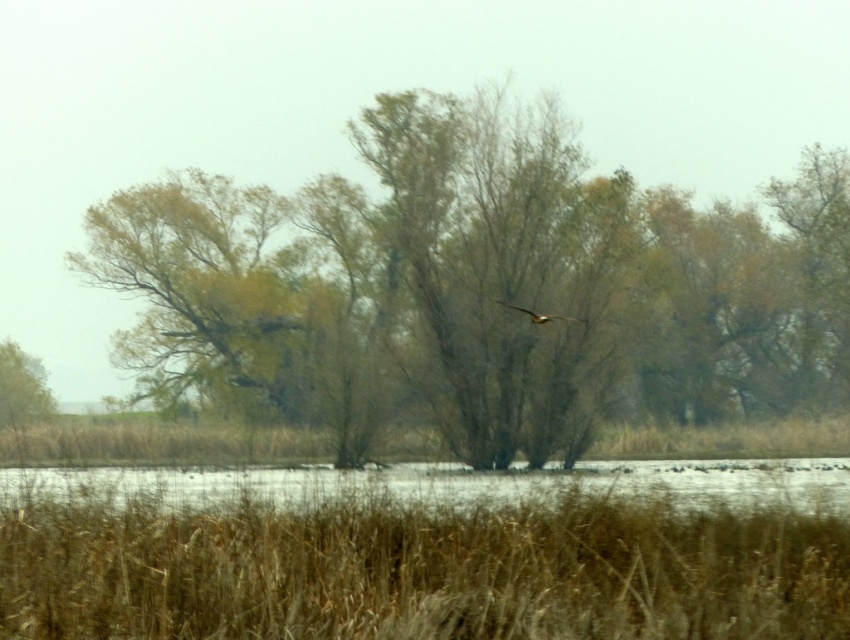
You are a birdwatcher observing the scene. You see the brown leafy tree at left and the brown feathered bird at center. Which object is taller?

The brown leafy tree at left is much taller than the brown feathered bird at center.

What object is located at the coordinates point (428,552) in the image?

The point (428,552) corresponds to brown dry grass at lower center.

You are standing in the serene autumn landscape and notice a brown leafy tree at left and a brown feathered bird at center. Which object is closer to you, the observer?

The brown leafy tree at left is closer to you because the brown feathered bird at center is positioned behind it.